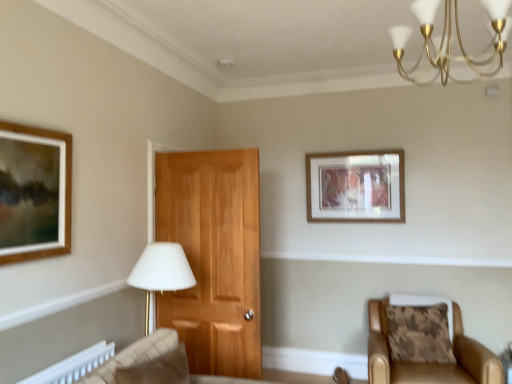
Question: Looking at their shapes, would you say brown textured pillow at lower right is wider or thinner than leather armchair at lower right?

Choices:
 (A) thin
 (B) wide

Answer: (A)

Question: Based on their positions, is brown textured pillow at lower right located to the left or right of leather armchair at lower right?

Choices:
 (A) left
 (B) right

Answer: (B)

Question: Based on their relative distances, which object is nearer to the wooden picture frame at upper center?

Choices:
 (A) gold metallic chandelier at upper right
 (B) leather armchair at lower right
 (C) brown textured pillow at lower right

Answer: (C)

Question: Which object is positioned closest to the gold metallic chandelier at upper right?

Choices:
 (A) wooden picture frame at upper center
 (B) leather armchair at lower right
 (C) brown textured pillow at lower right

Answer: (A)